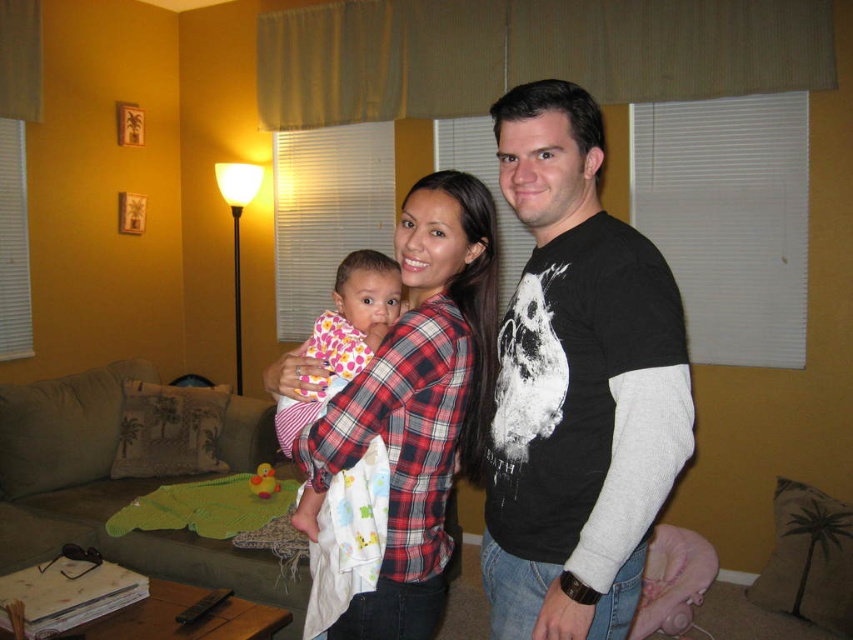
Can you confirm if plaid shirt at center is positioned to the left of polka dot fabric baby at center?

In fact, plaid shirt at center is to the right of polka dot fabric baby at center.

Is point (352, 624) closer to camera compared to point (329, 321)?

Yes.

Does point (374, 339) lie behind point (386, 326)?

No, it is in front of (386, 326).

I want to click on plaid shirt at center, so click(x=418, y=403).

Which is above, black matte t-shirt at center or plaid shirt at center?

black matte t-shirt at center

Between black matte t-shirt at center and plaid shirt at center, which one has less height?

plaid shirt at center is shorter.

The image size is (853, 640). Describe the element at coordinates (577, 385) in the screenshot. I see `black matte t-shirt at center` at that location.

Locate an element on the screen. This screenshot has width=853, height=640. black matte t-shirt at center is located at coordinates (577, 385).

In the scene shown: Is black matte t-shirt at center bigger than polka dot fabric baby at center?

Correct, black matte t-shirt at center is larger in size than polka dot fabric baby at center.

Which is behind, point (561, 499) or point (317, 500)?

Point (317, 500)

Which is in front, point (544, 440) or point (341, 272)?

Point (544, 440)

Identify the location of black matte t-shirt at center. The width and height of the screenshot is (853, 640). (577, 385).